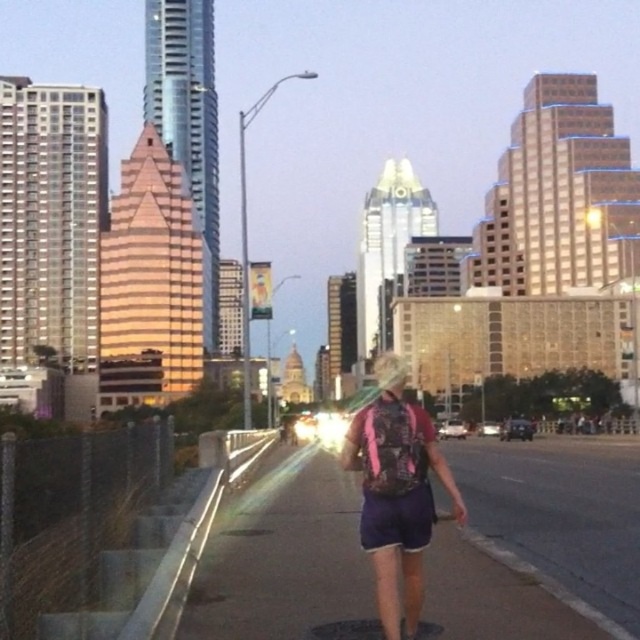
Can you confirm if purple fabric pavement at center is smaller than pink fabric shorts at center?

No.

Which is more to the right, purple fabric pavement at center or pink fabric shorts at center?

From the viewer's perspective, purple fabric pavement at center appears more on the right side.

Is point (308, 499) positioned behind point (376, 380)?

Yes.

Locate an element on the screen. This screenshot has width=640, height=640. purple fabric pavement at center is located at coordinates (532, 545).